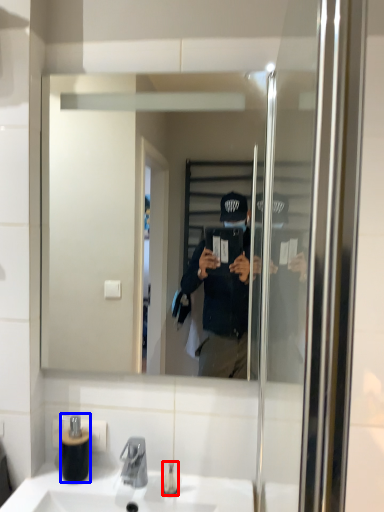
Question: Which of the following is the farthest to the observer, toiletry (highlighted by a red box) or bottle (highlighted by a blue box)?

Choices:
 (A) toiletry
 (B) bottle

Answer: (B)